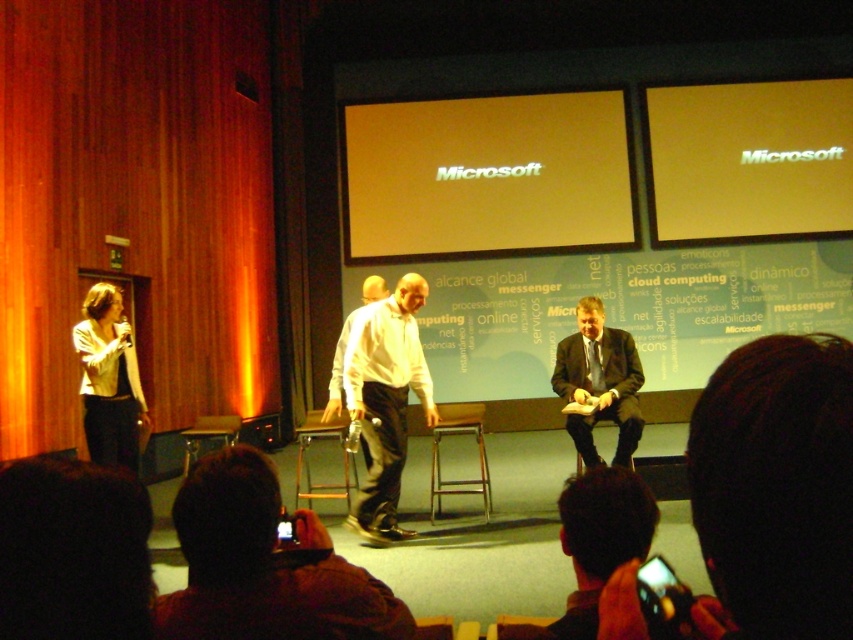
You are an attendee in the conference hall and want to know which of the two points, point (380, 456) or point (630, 445), is closer to the stage. Can you determine this based on their positions?

Point (380, 456) is in front of point (630, 445), so it is closer to the stage.

You are a stagehand who needs to place a 3.5 feet wide decorative panel between the white matte shirt at center and the dark blue suit at center. Can you fit it without overlapping either?

The distance between the white matte shirt at center and the dark blue suit at center is 4.07 feet. Since the panel is 3.5 feet wide, it can fit as long as the placement allows enough space on both sides. However, exact positioning depends on their exact positions, but based on the given distance, it is possible.

You are setting up a projector for a presentation in the conference hall. The projector can only project onto surfaces that are at least 2 meters tall. Given the yellow matte projection screen at center and the metallic silver chair at lower center, which object meets the height requirement?

The yellow matte projection screen at center is taller than the metallic silver chair at lower center, so the yellow matte projection screen at center meets the height requirement as it is at least 2 meters tall.